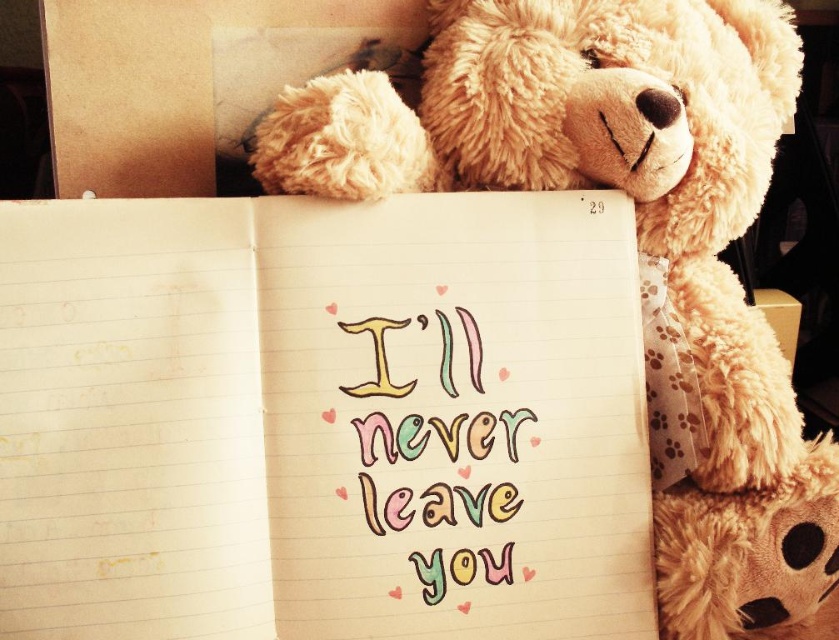
You are an artist trying to sketch the scene. You need to decide the vertical positioning of the yellow lined paper at upper center and the fluffy beige teddy bear at upper right. Based on the scene, which object is shorter in height?

The yellow lined paper at upper center has a lesser height compared to the fluffy beige teddy bear at upper right, so the yellow lined paper at upper center is shorter in height.

You are an AI assistant analyzing the scene. The teddy bear is at the center. Where is the yellow lined paper at upper center positioned relative to the teddy bear?

The yellow lined paper at upper center is located at point (322,419), which is in front of the teddy bear since it is positioned at the center and the paper is at upper center.